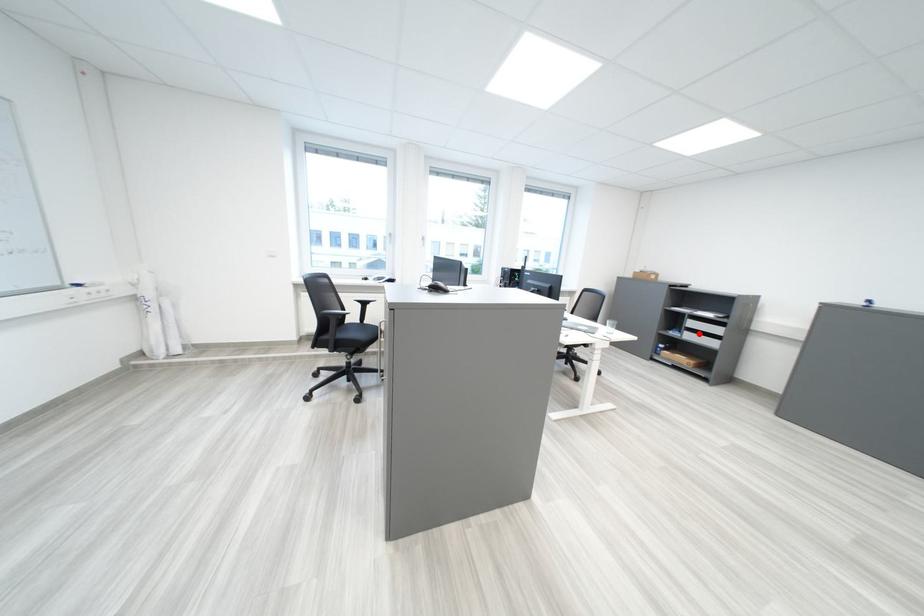
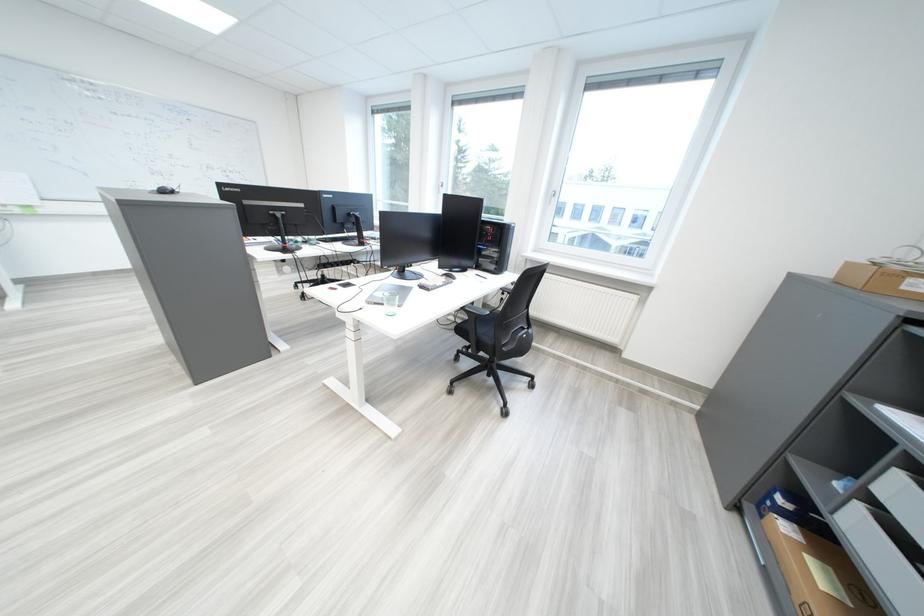
Question: I am providing you with two images of the same scene from different viewpoints. A red point is shown in image1. For the corresponding object point in image2, is it positioned nearer or farther from the camera?

Choices:
 (A) Nearer
 (B) Farther

Answer: (B)